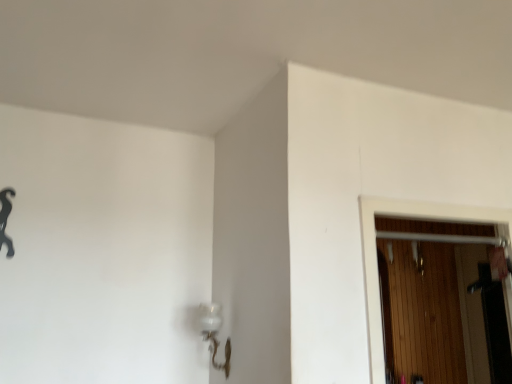
Describe the element at coordinates (214, 334) in the screenshot. The height and width of the screenshot is (384, 512). I see `clear glass lamp at lower center` at that location.

What do you see at coordinates (422, 311) in the screenshot?
I see `wooden at right` at bounding box center [422, 311].

The width and height of the screenshot is (512, 384). I want to click on clear glass lamp at lower center, so click(214, 334).

Considering the relative sizes of wooden at right and black matte hook at upper left in the image provided, is wooden at right thinner than black matte hook at upper left?

In fact, wooden at right might be wider than black matte hook at upper left.

Is wooden at right at the left side of black matte hook at upper left?

No.

Can you tell me how much wooden at right and black matte hook at upper left differ in facing direction?

There is a 1.11-degree angle between the facing directions of wooden at right and black matte hook at upper left.

Between wooden at right and black matte hook at upper left, which one has larger size?

With larger size is wooden at right.

Considering the relative sizes of black matte hook at upper left and wooden at right in the image provided, is black matte hook at upper left thinner than wooden at right?

Yes, black matte hook at upper left is thinner than wooden at right.

Which object is more forward, black matte hook at upper left or wooden at right?

wooden at right.

What's the angular difference between black matte hook at upper left and wooden at right's facing directions?

black matte hook at upper left and wooden at right are facing 1.11 degrees away from each other.

From a real-world perspective, is wooden at right positioned over clear glass lamp at lower center based on gravity?

Correct, in the physical world, wooden at right is higher than clear glass lamp at lower center.

Is clear glass lamp at lower center surrounded by wooden at right?

That's incorrect, clear glass lamp at lower center is not inside wooden at right.

From the picture: Would you say wooden at right is a long distance from clear glass lamp at lower center?

That's right, there is a large distance between wooden at right and clear glass lamp at lower center.

This screenshot has width=512, height=384. In order to click on door above the clear glass lamp at lower center (from the image's perspective) in this screenshot , I will do `click(422, 311)`.

Can clear glass lamp at lower center be found inside black matte hook at upper left?

No, black matte hook at upper left does not contain clear glass lamp at lower center.

Is point (9, 204) farther from viewer compared to point (218, 316)?

No.

Could you tell me if black matte hook at upper left is facing clear glass lamp at lower center?

No, black matte hook at upper left is not oriented towards clear glass lamp at lower center.

Consider the image. Is black matte hook at upper left to the right of clear glass lamp at lower center from the viewer's perspective?

Incorrect, black matte hook at upper left is not on the right side of clear glass lamp at lower center.

From the image's perspective, is clear glass lamp at lower center positioned above or below black matte hook at upper left?

Based on their image positions, clear glass lamp at lower center is located beneath black matte hook at upper left.

Does clear glass lamp at lower center touch black matte hook at upper left?

No, clear glass lamp at lower center is not making contact with black matte hook at upper left.

Is clear glass lamp at lower center smaller than black matte hook at upper left?

No, clear glass lamp at lower center is not smaller than black matte hook at upper left.

The height and width of the screenshot is (384, 512). I want to click on lamp behind the black matte hook at upper left, so click(214, 334).

Is point (228, 371) positioned behind point (437, 245)?

No, it is in front of (437, 245).

From a real-world perspective, is clear glass lamp at lower center below wooden at right?

Yes, from a real-world perspective, clear glass lamp at lower center is beneath wooden at right.

Is clear glass lamp at lower center inside or outside of wooden at right?

clear glass lamp at lower center is not inside wooden at right, it's outside.

Locate an element on the screen. lamp below the wooden at right (from the image's perspective) is located at coordinates (214, 334).

Where is `door below the black matte hook at upper left (from the image's perspective)`? Image resolution: width=512 pixels, height=384 pixels. door below the black matte hook at upper left (from the image's perspective) is located at coordinates (422, 311).

Image resolution: width=512 pixels, height=384 pixels. In order to click on woman lying above the wooden at right (from the image's perspective) in this screenshot , I will do `click(6, 219)`.

Based on their spatial positions, is wooden at right or black matte hook at upper left further from clear glass lamp at lower center?

wooden at right is positioned further to the anchor clear glass lamp at lower center.

Based on their spatial positions, is black matte hook at upper left or wooden at right closer to clear glass lamp at lower center?

black matte hook at upper left.

When comparing their distances from black matte hook at upper left, does wooden at right or clear glass lamp at lower center seem further?

The object further to black matte hook at upper left is wooden at right.

Looking at this image, which object lies nearer to the anchor point wooden at right, clear glass lamp at lower center or black matte hook at upper left?

Among the two, clear glass lamp at lower center is located nearer to wooden at right.

Looking at the image, which one is located closer to black matte hook at upper left, clear glass lamp at lower center or wooden at right?

clear glass lamp at lower center lies closer to black matte hook at upper left than the other object.

Which object lies nearer to the anchor point wooden at right, black matte hook at upper left or clear glass lamp at lower center?

clear glass lamp at lower center.

The height and width of the screenshot is (384, 512). In order to click on lamp between black matte hook at upper left and wooden at right in the horizontal direction in this screenshot , I will do `click(214, 334)`.